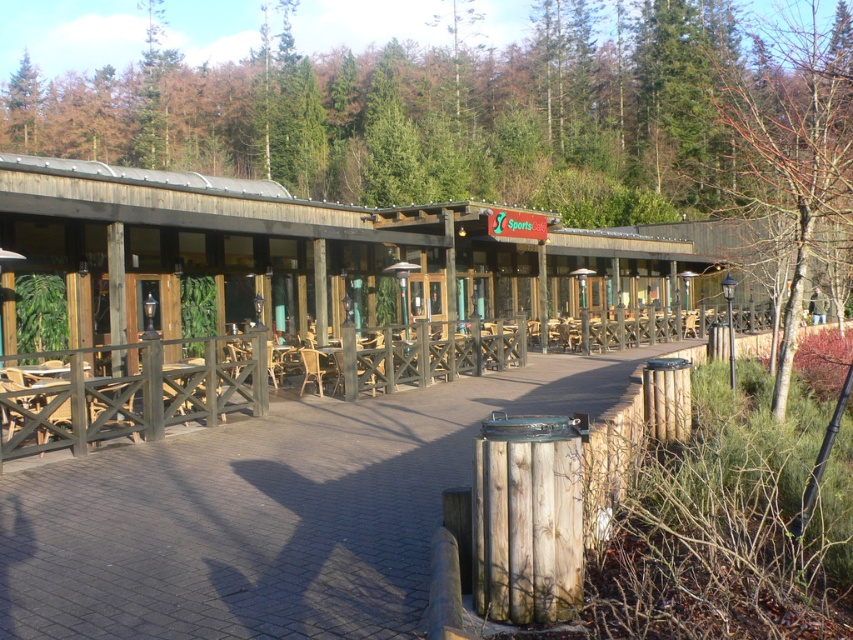
Question: Is wooden walkway at center to the right of bare branches at right from the viewer's perspective?

Choices:
 (A) yes
 (B) no

Answer: (B)

Question: Among these objects, which one is nearest to the camera?

Choices:
 (A) bare branches at right
 (B) wooden walkway at center

Answer: (B)

Question: Among these objects, which one is nearest to the camera?

Choices:
 (A) bare branches at right
 (B) wooden walkway at center

Answer: (B)

Question: Is wooden walkway at center to the left of bare branches at right from the viewer's perspective?

Choices:
 (A) no
 (B) yes

Answer: (B)

Question: Can you confirm if wooden walkway at center is positioned below bare branches at right?

Choices:
 (A) yes
 (B) no

Answer: (A)